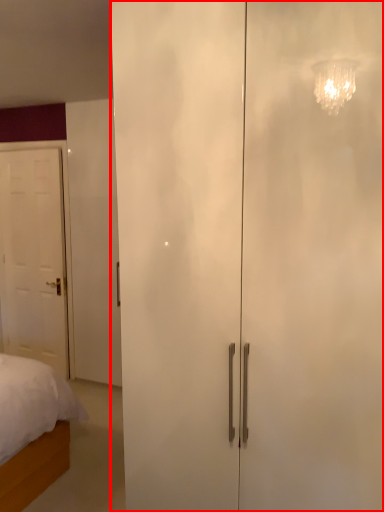
Question: From the image's perspective, where is door (annotated by the red box) located in relation to door in the image?

Choices:
 (A) below
 (B) above

Answer: (A)